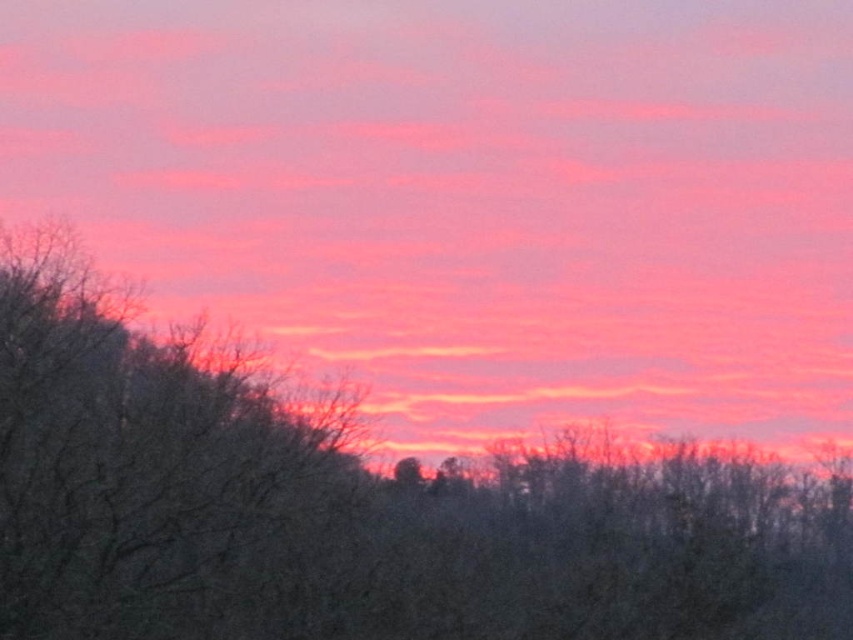
Measure the distance between point (157, 74) and camera.

Point (157, 74) and camera are 79.73 meters apart.

Who is more forward, (792, 216) or (67, 333)?

Point (67, 333)

The width and height of the screenshot is (853, 640). What are the coordinates of `pink matte cloud at upper center` in the screenshot? It's located at (469, 196).

Between brown matte tree at center and brown textured tree at left, which one appears on the right side from the viewer's perspective?

brown matte tree at center

Can you confirm if brown matte tree at center is smaller than brown textured tree at left?

No, brown matte tree at center is not smaller than brown textured tree at left.

The width and height of the screenshot is (853, 640). What do you see at coordinates (357, 506) in the screenshot?
I see `brown matte tree at center` at bounding box center [357, 506].

Identify the location of brown matte tree at center. (357, 506).

Can you confirm if pink matte cloud at upper center is positioned below brown textured tree at left?

No.

Between pink matte cloud at upper center and brown textured tree at left, which one appears on the left side from the viewer's perspective?

From the viewer's perspective, brown textured tree at left appears more on the left side.

Does point (814, 168) come closer to viewer compared to point (41, 307)?

No, it is not.

Locate an element on the screen. pink matte cloud at upper center is located at coordinates (469, 196).